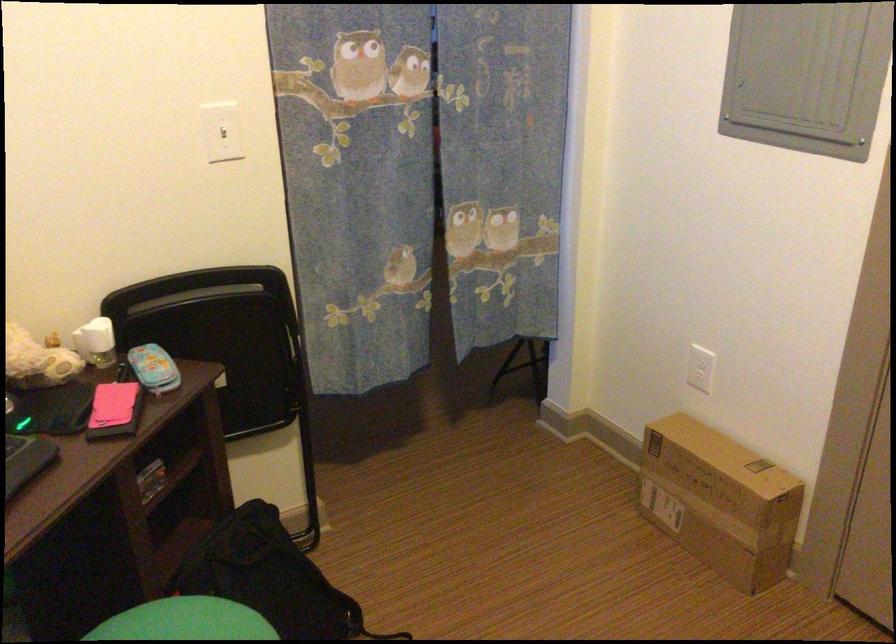
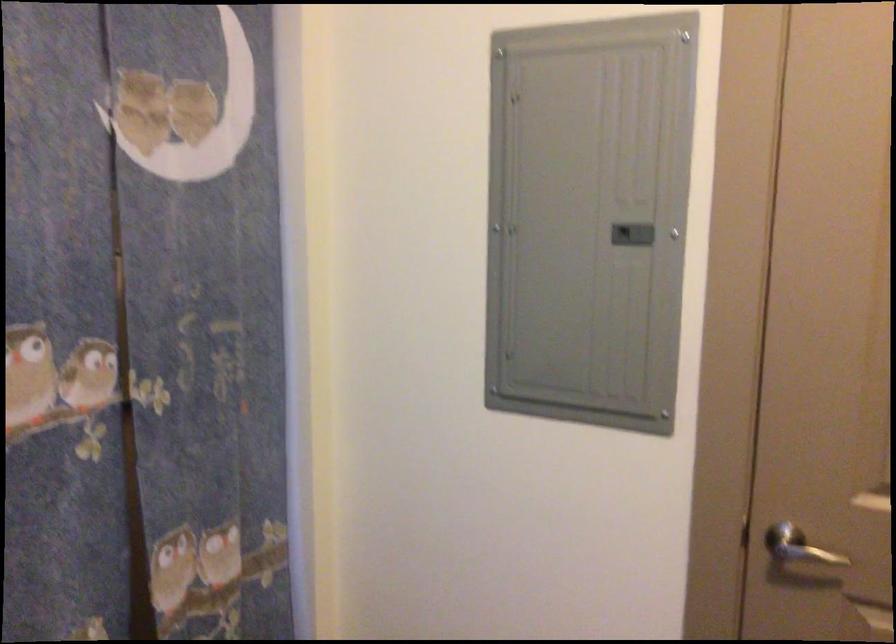
Question: The camera is either moving clockwise (left) or counter-clockwise (right) around the object. The first image is from the beginning of the video and the second image is from the end. Is the camera moving left or right when shooting the video?

Choices:
 (A) Left
 (B) Right

Answer: (A)